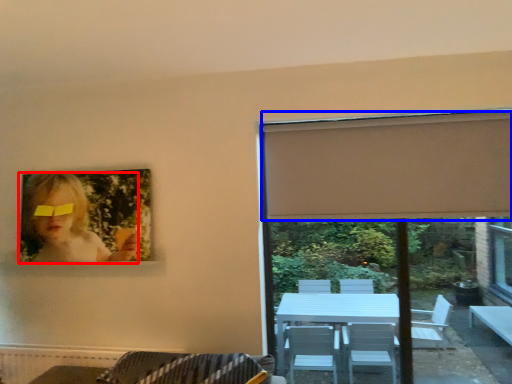
Question: Among these objects, which one is farthest to the camera, woman (highlighted by a red box) or curtain (highlighted by a blue box)?

Choices:
 (A) woman
 (B) curtain

Answer: (A)